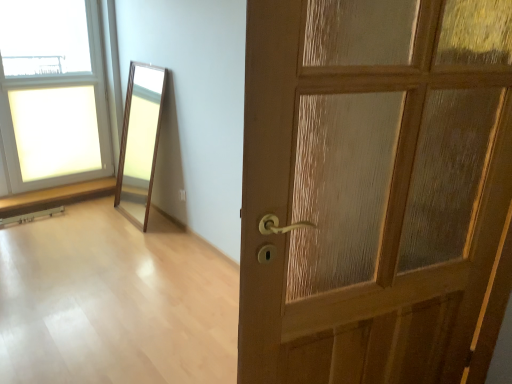
The width and height of the screenshot is (512, 384). I want to click on wooden door at right, so click(x=371, y=186).

Find the location of a particular element. The height and width of the screenshot is (384, 512). clear glass window at upper left is located at coordinates (59, 86).

The height and width of the screenshot is (384, 512). Describe the element at coordinates (114, 302) in the screenshot. I see `wooden floor at center` at that location.

Identify the location of wooden door at right. This screenshot has width=512, height=384. (371, 186).

Where is `window located behind the wooden floor at center`? This screenshot has width=512, height=384. window located behind the wooden floor at center is located at coordinates (59, 86).

Does point (23, 88) lie behind point (62, 342)?

Yes, point (23, 88) is farther from viewer.

Is clear glass window at upper left with wooden floor at center?

No.

From a real-world perspective, does clear glass window at upper left sit lower than wooden floor at center?

No, from a real-world perspective, clear glass window at upper left is not beneath wooden floor at center.

I want to click on corridor below the clear glass window at upper left (from the image's perspective), so click(114, 302).

Is wooden floor at center oriented away from clear glass window at upper left?

That's not correct — wooden floor at center is not looking away from clear glass window at upper left.

Between wooden floor at center and clear glass window at upper left, which one has larger width?

wooden floor at center.

In the scene shown: Considering the sizes of wooden floor at center and clear glass window at upper left in the image, is wooden floor at center taller or shorter than clear glass window at upper left?

Considering their sizes, wooden floor at center has less height than clear glass window at upper left.

Locate an element on the screen. This screenshot has width=512, height=384. window above the wooden door at right (from the image's perspective) is located at coordinates (59, 86).

Based on the photo, is clear glass window at upper left smaller than wooden door at right?

Actually, clear glass window at upper left might be larger than wooden door at right.

Which is further, (95, 150) or (380, 25)?

The point (95, 150) is farther.

What's the angular difference between clear glass window at upper left and wooden door at right's facing directions?

The angular difference between clear glass window at upper left and wooden door at right is 167 degrees.

Are wooden door at right and clear glass window at upper left far apart?

Indeed, wooden door at right is not near clear glass window at upper left.

Does wooden door at right have a greater height compared to clear glass window at upper left?

In fact, wooden door at right may be shorter than clear glass window at upper left.

Measure the distance between wooden door at right and clear glass window at upper left.

wooden door at right and clear glass window at upper left are 2.42 meters apart.

This screenshot has width=512, height=384. I want to click on window lying on the left of wooden door at right, so click(59, 86).

Between wooden door at right and wooden floor at center, which one has larger size?

With larger size is wooden door at right.

Consider the image. How much distance is there between wooden door at right and wooden floor at center?

A distance of 3.89 feet exists between wooden door at right and wooden floor at center.

Is wooden door at right turned away from wooden floor at center?

No.

From the image's perspective, is wooden door at right under wooden floor at center?

No, from the image's perspective, wooden door at right is not beneath wooden floor at center.

What's the angular difference between wooden floor at center and wooden door at right's facing directions?

104 degrees.

Is wooden floor at center at the right side of wooden door at right?

In fact, wooden floor at center is to the left of wooden door at right.

Is point (47, 255) closer or farther from the camera than point (391, 323)?

Point (47, 255) is positioned farther from the camera compared to point (391, 323).

Does wooden floor at center lie behind wooden door at right?

Yes, wooden floor at center is further from the camera.

Locate an element on the screen. corridor below the clear glass window at upper left (from a real-world perspective) is located at coordinates (114, 302).

The height and width of the screenshot is (384, 512). I want to click on window that appears behind the wooden floor at center, so click(x=59, y=86).

Based on their spatial positions, is wooden door at right or wooden floor at center closer to clear glass window at upper left?

Among the two, wooden floor at center is located nearer to clear glass window at upper left.

Estimate the real-world distances between objects in this image. Which object is further from wooden door at right, wooden floor at center or clear glass window at upper left?

Among the two, clear glass window at upper left is located further to wooden door at right.

Based on their spatial positions, is clear glass window at upper left or wooden floor at center further from wooden door at right?

clear glass window at upper left.

When comparing their distances from wooden floor at center, does clear glass window at upper left or wooden door at right seem closer?

wooden door at right is closer to wooden floor at center.

Estimate the real-world distances between objects in this image. Which object is further from wooden floor at center, wooden door at right or clear glass window at upper left?

clear glass window at upper left lies further to wooden floor at center than the other object.

Based on their spatial positions, is wooden floor at center or wooden door at right closer to clear glass window at upper left?

wooden floor at center.

Where is `corridor between wooden door at right and clear glass window at upper left from front to back`? corridor between wooden door at right and clear glass window at upper left from front to back is located at coordinates (114, 302).